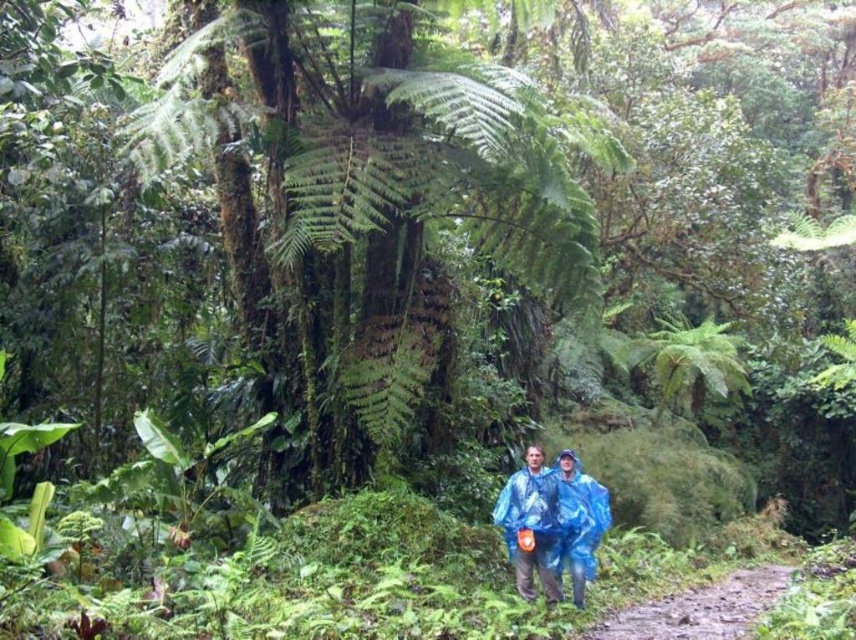
Which is below, blue waterproof poncho at center or dirt path at lower center?

dirt path at lower center is below.

Is blue waterproof poncho at center smaller than dirt path at lower center?

No, blue waterproof poncho at center is not smaller than dirt path at lower center.

Who is more forward, (566,556) or (721,624)?

Point (721,624)

Locate an element on the screen. This screenshot has height=640, width=856. blue waterproof poncho at center is located at coordinates (551, 522).

Is dirt path at lower center wider than green leafy fern at upper right?

Incorrect, dirt path at lower center's width does not surpass green leafy fern at upper right's.

Can you confirm if dirt path at lower center is positioned to the right of green leafy fern at upper right?

Incorrect, dirt path at lower center is not on the right side of green leafy fern at upper right.

Who is more distant from viewer, [753,586] or [652,372]?

Point [652,372]

I want to click on dirt path at lower center, so click(700, 609).

Is the position of blue waterproof poncho at center less distant than that of green leafy fern at upper right?

Yes, it is in front of green leafy fern at upper right.

From the picture: Is blue waterproof poncho at center below green leafy fern at upper right?

Indeed, blue waterproof poncho at center is positioned under green leafy fern at upper right.

Where is `blue waterproof poncho at center`? The width and height of the screenshot is (856, 640). blue waterproof poncho at center is located at coordinates (551, 522).